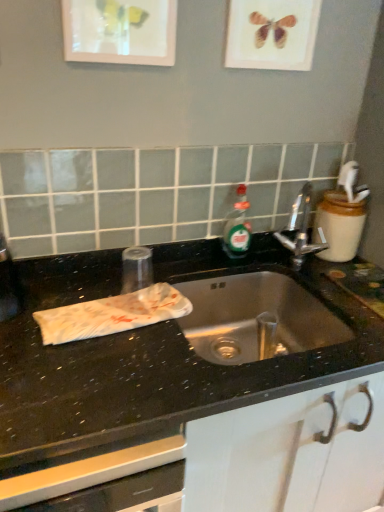
Locate an element on the screen. polished chrome faucet at center is located at coordinates (300, 230).

In order to face matte wooden picture frame at upper center, the second picture frame from the left, should I rotate leftwards or rightwards?

You should look right and rotate roughly 10.797 degrees.

Measure the distance between matte glass picture frame at upper center, the first picture frame positioned from the left, and camera.

matte glass picture frame at upper center, the first picture frame positioned from the left, is 37.34 inches away from camera.

What do you see at coordinates (112, 314) in the screenshot?
I see `white paper towel at left` at bounding box center [112, 314].

Identify the location of polished chrome faucet at center. (300, 230).

Considering their positions, is polished chrome faucet at center located in front of or behind matte wooden picture frame at upper center, the first picture frame in the right-to-left sequence?

Visually, polished chrome faucet at center is located behind matte wooden picture frame at upper center, the first picture frame in the right-to-left sequence.

Is polished chrome faucet at center aimed at matte wooden picture frame at upper center, the first picture frame in the right-to-left sequence?

No, polished chrome faucet at center is not turned towards matte wooden picture frame at upper center, the first picture frame in the right-to-left sequence.

Which is more distant, (292, 227) or (289, 66)?

The point (292, 227) is behind.

How many degrees apart are the facing directions of polished chrome faucet at center and matte wooden picture frame at upper center, the first picture frame in the right-to-left sequence?

They differ by 38.2 degrees in their facing directions.

Is the position of matte glass picture frame at upper center, the second picture frame when ordered from right to left, more distant than that of white paper towel at left?

Yes, it is.

From the image's perspective, between matte glass picture frame at upper center, the first picture frame positioned from the left, and white paper towel at left, who is located below?

From the image's view, white paper towel at left is below.

Are matte glass picture frame at upper center, the second picture frame when ordered from right to left, and white paper towel at left beside each other?

No, matte glass picture frame at upper center, the second picture frame when ordered from right to left, is not next to white paper towel at left.

Looking at this image, who is smaller, matte glass picture frame at upper center, the second picture frame when ordered from right to left, or white paper towel at left?

matte glass picture frame at upper center, the second picture frame when ordered from right to left.

Which of these two, matte wooden picture frame at upper center, the first picture frame in the right-to-left sequence, or white paper towel at left, is smaller?

Smaller between the two is matte wooden picture frame at upper center, the first picture frame in the right-to-left sequence.

From a real-world perspective, relative to white paper towel at left, is matte wooden picture frame at upper center, the first picture frame in the right-to-left sequence, vertically above or below?

matte wooden picture frame at upper center, the first picture frame in the right-to-left sequence, is situated higher than white paper towel at left in the real world.

Is matte wooden picture frame at upper center, the first picture frame in the right-to-left sequence, beside white paper towel at left?

No, matte wooden picture frame at upper center, the first picture frame in the right-to-left sequence, is not beside white paper towel at left.

Which is closer to the camera, [231,59] or [81,311]?

Point [231,59] appears to be farther away from the viewer than point [81,311].

From the image's perspective, which one is positioned lower, matte glass picture frame at upper center, the first picture frame positioned from the left, or black granite sink at center?

From the image's view, black granite sink at center is below.

Considering the sizes of objects matte glass picture frame at upper center, the second picture frame when ordered from right to left, and black granite sink at center in the image provided, who is smaller, matte glass picture frame at upper center, the second picture frame when ordered from right to left, or black granite sink at center?

Smaller between the two is matte glass picture frame at upper center, the second picture frame when ordered from right to left.

Could black granite sink at center be considered to be inside matte glass picture frame at upper center, the second picture frame when ordered from right to left?

No, matte glass picture frame at upper center, the second picture frame when ordered from right to left, does not contain black granite sink at center.

Is polished chrome faucet at center at the right side of white paper towel at left?

Yes, polished chrome faucet at center is to the right of white paper towel at left.

Is white paper towel at left a part of polished chrome faucet at center?

No.

From a real-world perspective, who is located lower, polished chrome faucet at center or white paper towel at left?

From a 3D spatial view, white paper towel at left is below.

Identify the location of tap positioned vertically above the white paper towel at left (from a real-world perspective). The height and width of the screenshot is (512, 384). (300, 230).

How far apart are black granite sink at center and matte glass picture frame at upper center, the second picture frame when ordered from right to left?

A distance of 26.23 inches exists between black granite sink at center and matte glass picture frame at upper center, the second picture frame when ordered from right to left.

Based on the photo, which of these two, black granite sink at center or matte glass picture frame at upper center, the first picture frame positioned from the left, is thinner?

matte glass picture frame at upper center, the first picture frame positioned from the left.

Is black granite sink at center in front of or behind matte glass picture frame at upper center, the second picture frame when ordered from right to left, in the image?

black granite sink at center is in front of matte glass picture frame at upper center, the second picture frame when ordered from right to left.

Is black granite sink at center facing towards matte glass picture frame at upper center, the second picture frame when ordered from right to left?

No.

From the image's perspective, is matte wooden picture frame at upper center, the first picture frame in the right-to-left sequence, above or below polished chrome faucet at center?

matte wooden picture frame at upper center, the first picture frame in the right-to-left sequence, is above polished chrome faucet at center.

Is matte wooden picture frame at upper center, the first picture frame in the right-to-left sequence, at the left side of polished chrome faucet at center?

Yes, matte wooden picture frame at upper center, the first picture frame in the right-to-left sequence, is to the left of polished chrome faucet at center.

From the picture: From a real-world perspective, is matte wooden picture frame at upper center, the second picture frame from the left, located beneath polished chrome faucet at center?

No, from a real-world perspective, matte wooden picture frame at upper center, the second picture frame from the left, is not under polished chrome faucet at center.

Locate an element on the screen. tap below the matte wooden picture frame at upper center, the first picture frame in the right-to-left sequence (from the image's perspective) is located at coordinates (300, 230).

This screenshot has width=384, height=512. In order to click on material on the left of matte glass picture frame at upper center, the second picture frame when ordered from right to left in this screenshot , I will do `click(112, 314)`.

From the image, which object appears to be farther from polished chrome faucet at center, matte wooden picture frame at upper center, the first picture frame in the right-to-left sequence, or white paper towel at left?

A: white paper towel at left is further to polished chrome faucet at center.

From the image, which object appears to be nearer to matte glass picture frame at upper center, the second picture frame when ordered from right to left, black granite sink at center or white paper towel at left?

white paper towel at left.

From the image, which object appears to be nearer to matte wooden picture frame at upper center, the second picture frame from the left, matte glass picture frame at upper center, the second picture frame when ordered from right to left, or polished chrome faucet at center?

matte glass picture frame at upper center, the second picture frame when ordered from right to left, lies closer to matte wooden picture frame at upper center, the second picture frame from the left, than the other object.

Looking at the image, which one is located closer to polished chrome faucet at center, white paper towel at left or matte glass picture frame at upper center, the second picture frame when ordered from right to left?

white paper towel at left is positioned closer to the anchor polished chrome faucet at center.

Estimate the real-world distances between objects in this image. Which object is closer to polished chrome faucet at center, white paper towel at left or black granite sink at center?

Among the two, black granite sink at center is located nearer to polished chrome faucet at center.

Based on their spatial positions, is polished chrome faucet at center or white paper towel at left further from black granite sink at center?

Among the two, polished chrome faucet at center is located further to black granite sink at center.

Based on the photo, from the image, which object appears to be nearer to matte wooden picture frame at upper center, the second picture frame from the left, white paper towel at left or matte glass picture frame at upper center, the second picture frame when ordered from right to left?

matte glass picture frame at upper center, the second picture frame when ordered from right to left.

Based on their spatial positions, is polished chrome faucet at center or matte wooden picture frame at upper center, the first picture frame in the right-to-left sequence, closer to white paper towel at left?

Based on the image, polished chrome faucet at center appears to be nearer to white paper towel at left.

Find the location of a particular element. material between matte wooden picture frame at upper center, the first picture frame in the right-to-left sequence, and black granite sink at center vertically is located at coordinates (112, 314).

I want to click on tap between matte wooden picture frame at upper center, the first picture frame in the right-to-left sequence, and white paper towel at left from top to bottom, so click(x=300, y=230).

The height and width of the screenshot is (512, 384). In order to click on material between polished chrome faucet at center and black granite sink at center in the up-down direction in this screenshot , I will do `click(112, 314)`.

Find the location of a particular element. material between matte glass picture frame at upper center, the first picture frame positioned from the left, and black granite sink at center vertically is located at coordinates (112, 314).